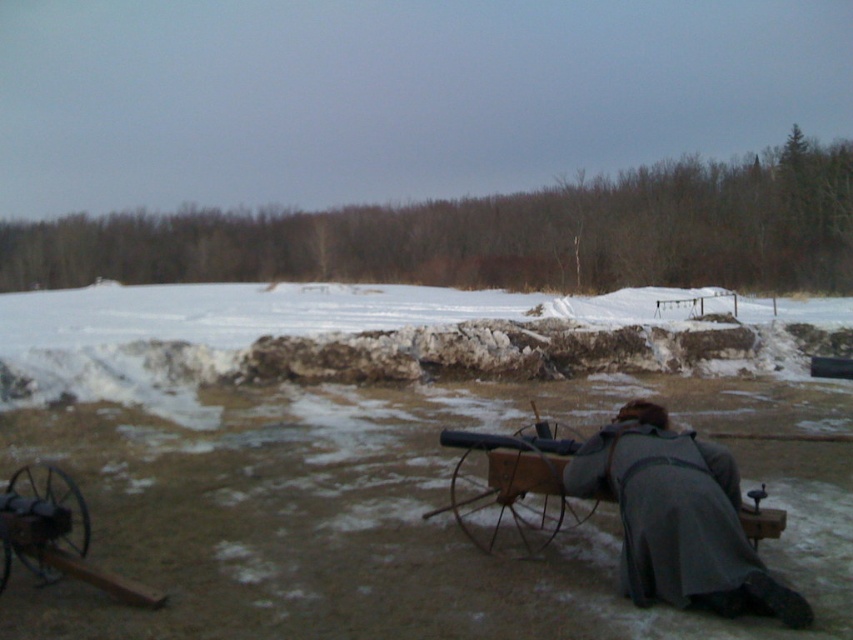
Based on the photo, is gray wool coat at lower center smaller than wooden cannon at lower left?

Actually, gray wool coat at lower center might be larger than wooden cannon at lower left.

Can you confirm if gray wool coat at lower center is shorter than wooden cannon at lower left?

No.

Locate an element on the screen. Image resolution: width=853 pixels, height=640 pixels. gray wool coat at lower center is located at coordinates (677, 518).

What are the coordinates of `gray wool coat at lower center` in the screenshot? It's located at (677, 518).

Between wooden wagon at center and wooden cannon at lower left, which one has less height?

wooden cannon at lower left is shorter.

Which is more to the left, wooden wagon at center or wooden cannon at lower left?

wooden cannon at lower left is more to the left.

This screenshot has height=640, width=853. In order to click on wooden wagon at center in this screenshot , I will do `click(515, 483)`.

Can you confirm if gray wool coat at lower center is positioned to the right of wooden wagon at center?

Yes, gray wool coat at lower center is to the right of wooden wagon at center.

Which of these two, gray wool coat at lower center or wooden wagon at center, stands shorter?

Standing shorter between the two is wooden wagon at center.

Who is more distant from viewer, (735, 513) or (526, 435)?

Positioned behind is point (526, 435).

Locate an element on the screen. This screenshot has width=853, height=640. gray wool coat at lower center is located at coordinates coord(677,518).